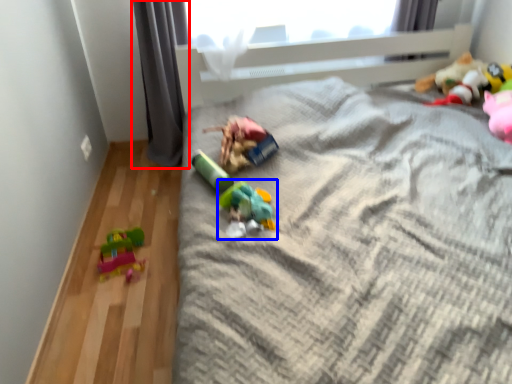
Question: Which of the following is the farthest to the observer, curtain (highlighted by a red box) or toy (highlighted by a blue box)?

Choices:
 (A) curtain
 (B) toy

Answer: (A)